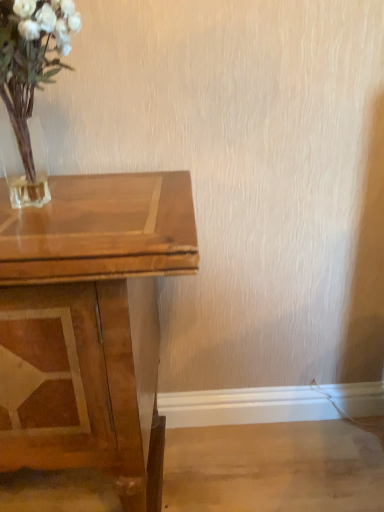
Consider the image. What is the approximate height of shiny brown wooden table at left?

It is 79.92 centimeters.

Describe the element at coordinates (90, 324) in the screenshot. The image size is (384, 512). I see `shiny brown wooden table at left` at that location.

Locate an element on the screen. The width and height of the screenshot is (384, 512). shiny brown wooden table at left is located at coordinates (90, 324).

Measure the distance between shiny brown wooden table at left and camera.

21.39 inches.

Image resolution: width=384 pixels, height=512 pixels. Describe the element at coordinates (31, 74) in the screenshot. I see `translucent glass vase at upper left` at that location.

Where is `translucent glass vase at upper left`? The width and height of the screenshot is (384, 512). translucent glass vase at upper left is located at coordinates (31, 74).

You are a GUI agent. You are given a task and a screenshot of the screen. Output one action in this format:
    pyautogui.click(x=<x>, y=<y>)
    Task: Click on the shiny brown wooden table at left
    The height and width of the screenshot is (512, 384).
    Given the screenshot: What is the action you would take?
    pyautogui.click(x=90, y=324)

Which object is positioned more to the right, translucent glass vase at upper left or shiny brown wooden table at left?

From the viewer's perspective, translucent glass vase at upper left appears more on the right side.

Which is behind, translucent glass vase at upper left or shiny brown wooden table at left?

shiny brown wooden table at left is further from the camera.

Considering the positions of points (22, 86) and (2, 436), is point (22, 86) closer to camera compared to point (2, 436)?

Yes, it is in front of point (2, 436).

From the image's perspective, which object appears higher, translucent glass vase at upper left or shiny brown wooden table at left?

translucent glass vase at upper left.

From a real-world perspective, is translucent glass vase at upper left over shiny brown wooden table at left?

Indeed, from a real-world perspective, translucent glass vase at upper left stands above shiny brown wooden table at left.

Which object is thinner, translucent glass vase at upper left or shiny brown wooden table at left?

With smaller width is translucent glass vase at upper left.

Considering the sizes of translucent glass vase at upper left and shiny brown wooden table at left in the image, is translucent glass vase at upper left taller or shorter than shiny brown wooden table at left?

Considering their sizes, translucent glass vase at upper left has less height than shiny brown wooden table at left.

Consider the image. Considering the relative sizes of translucent glass vase at upper left and shiny brown wooden table at left in the image provided, is translucent glass vase at upper left bigger than shiny brown wooden table at left?

No.

Can shiny brown wooden table at left be found inside translucent glass vase at upper left?

No, shiny brown wooden table at left is located outside of translucent glass vase at upper left.

Would you say translucent glass vase at upper left is a long distance from shiny brown wooden table at left?

No, translucent glass vase at upper left is not far away from shiny brown wooden table at left.

Is translucent glass vase at upper left oriented away from shiny brown wooden table at left?

That's not correct — translucent glass vase at upper left is not looking away from shiny brown wooden table at left.

Based on the photo, how many degrees apart are the facing directions of translucent glass vase at upper left and shiny brown wooden table at left?

translucent glass vase at upper left and shiny brown wooden table at left are facing 1.48 degrees away from each other.

In order to click on table located on the left of translucent glass vase at upper left in this screenshot , I will do `click(90, 324)`.

Would you say shiny brown wooden table at left is to the left or to the right of translucent glass vase at upper left in the picture?

Clearly, shiny brown wooden table at left is on the left of translucent glass vase at upper left in the image.

Does shiny brown wooden table at left come behind translucent glass vase at upper left?

Yes, the depth of shiny brown wooden table at left is greater than that of translucent glass vase at upper left.

Which is closer to the camera, (192, 267) or (57, 12)?

Point (192, 267) is positioned closer to the camera compared to point (57, 12).

From the image's perspective, between shiny brown wooden table at left and translucent glass vase at upper left, which one is located above?

From the image's view, translucent glass vase at upper left is above.

From a real-world perspective, is shiny brown wooden table at left located beneath translucent glass vase at upper left?

Yes.

Which object is wider, shiny brown wooden table at left or translucent glass vase at upper left?

With larger width is shiny brown wooden table at left.

Can you confirm if shiny brown wooden table at left is taller than translucent glass vase at upper left?

Yes.

Considering the sizes of shiny brown wooden table at left and translucent glass vase at upper left in the image, is shiny brown wooden table at left bigger or smaller than translucent glass vase at upper left?

shiny brown wooden table at left is bigger than translucent glass vase at upper left.

Would you say shiny brown wooden table at left contains translucent glass vase at upper left?

No.

Is shiny brown wooden table at left with translucent glass vase at upper left?

There is a gap between shiny brown wooden table at left and translucent glass vase at upper left.

Is shiny brown wooden table at left turned away from translucent glass vase at upper left?

No, translucent glass vase at upper left is not at the back of shiny brown wooden table at left.

Image resolution: width=384 pixels, height=512 pixels. What are the coordinates of `table on the left of translucent glass vase at upper left` in the screenshot? It's located at (90, 324).

This screenshot has height=512, width=384. I want to click on table located underneath the translucent glass vase at upper left (from a real-world perspective), so click(x=90, y=324).

Image resolution: width=384 pixels, height=512 pixels. Identify the location of table lying on the left of translucent glass vase at upper left. (90, 324).